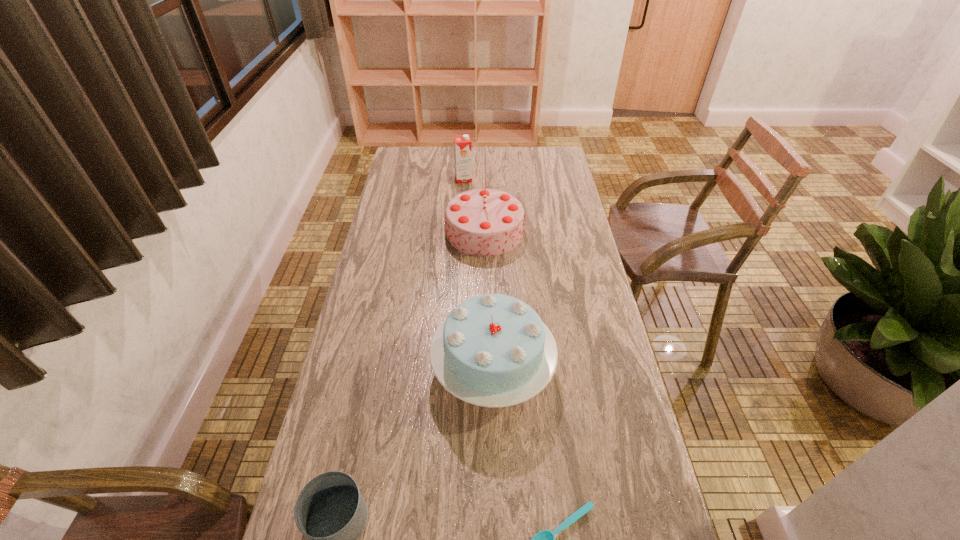
At what (x,y) coordinates should I click in order to perform the action: click on the fourth nearest object. Please return your answer as a coordinate pair (x, y). Looking at the image, I should click on (483, 222).

Identify the location of the third nearest object. (493, 350).

I want to click on carton, so click(x=462, y=144).

Image resolution: width=960 pixels, height=540 pixels. I want to click on free space located 0.100m on the back of the second farthest object, so click(484, 195).

Find the location of a particular element. free spot located on the front of the nearer birthday cake is located at coordinates (495, 453).

Find the location of a particular element. free space located on the right of the farthest object is located at coordinates (558, 179).

The width and height of the screenshot is (960, 540). I want to click on vacant space at the far edge of the desktop, so 513,163.

You are a GUI agent. You are given a task and a screenshot of the screen. Output one action in this format:
    pyautogui.click(x=<x>, y=<y>)
    Task: Click on the vacant space at the left edge
    
    Given the screenshot: What is the action you would take?
    pyautogui.click(x=369, y=389)

The width and height of the screenshot is (960, 540). I want to click on vacant area at the right edge, so click(x=604, y=401).

In the image, there is a desktop. Identify the location of vacant space at the far right corner. The image size is (960, 540). (533, 152).